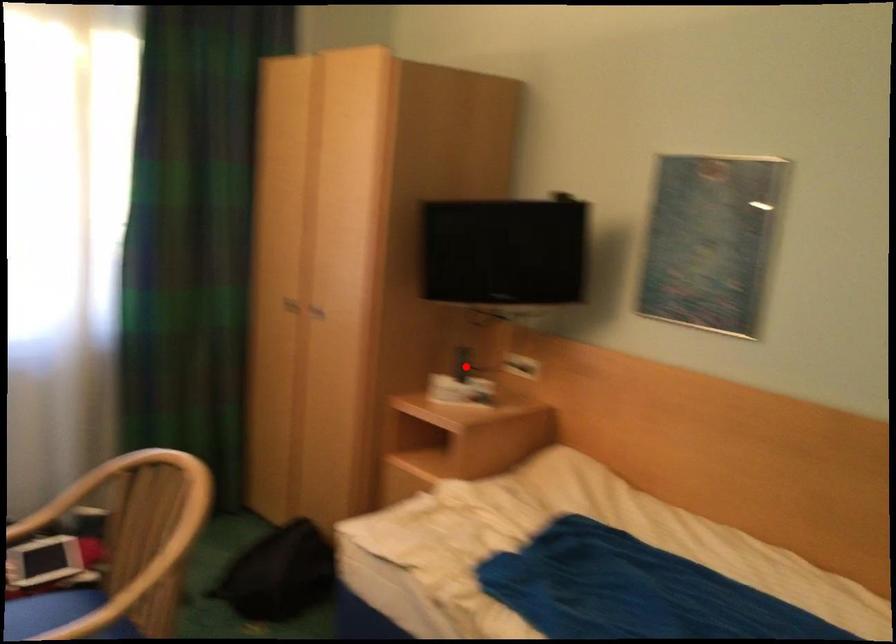
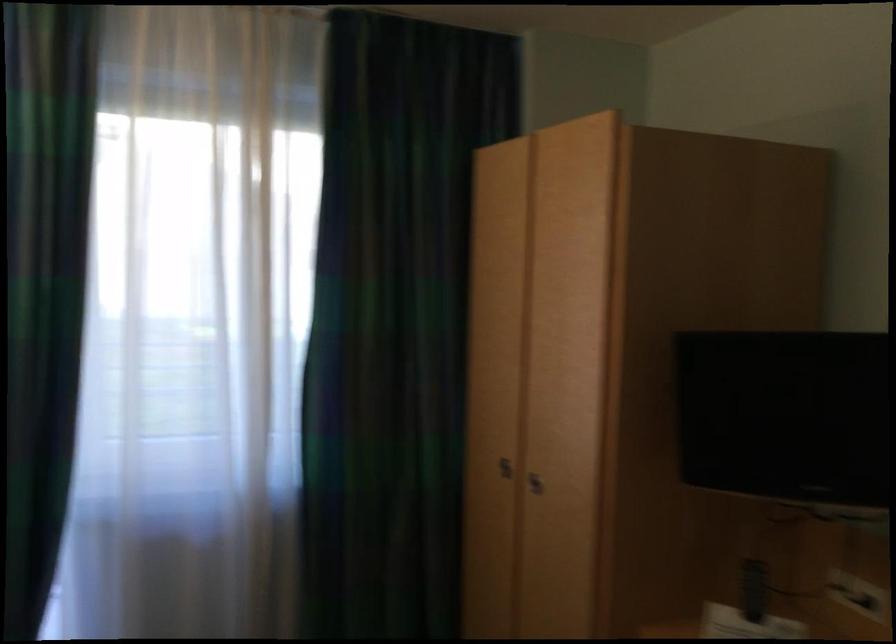
Question: I am providing you with two images of the same scene from different viewpoints. Given a red point in image1, look at the same physical point in image2. Is it:

Choices:
 (A) Closer to the viewpoint
 (B) Farther from the viewpoint

Answer: (A)